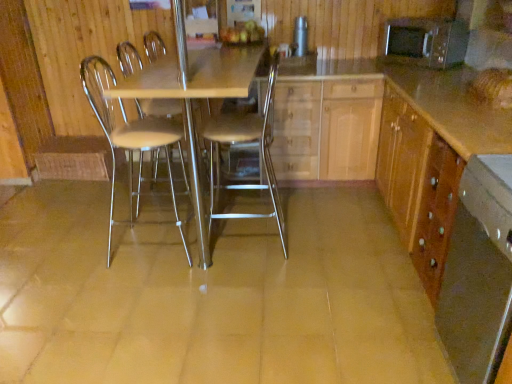
The image size is (512, 384). In order to click on free space to the left of metallic silver chair at center, which appears as the 1th chair when viewed from the left in this screenshot , I will do `click(87, 249)`.